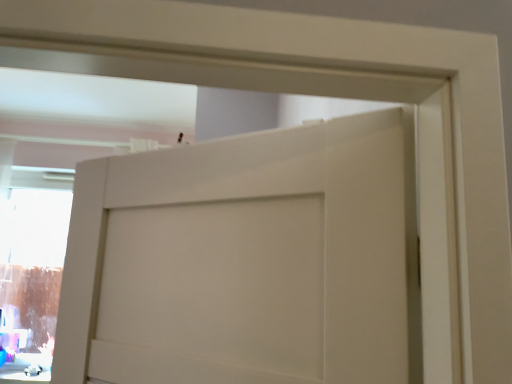
What do you see at coordinates (33, 260) in the screenshot?
I see `transparent glass window at lower left` at bounding box center [33, 260].

Image resolution: width=512 pixels, height=384 pixels. What are the coordinates of `transparent glass window at lower left` in the screenshot? It's located at (33, 260).

In order to click on transparent glass window at lower left in this screenshot , I will do `click(33, 260)`.